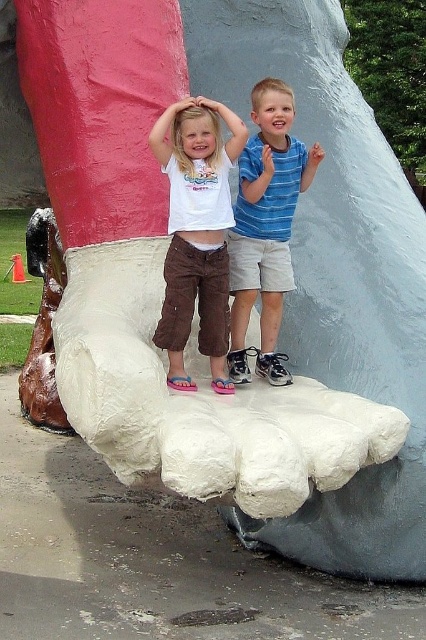
You are a photographer trying to capture both children in a photo. Since you can only focus on one child clearly at a time, which child should you focus on to ensure their face is in focus if you want the matte white shirt at center and the blue striped shirt at center to be in the same photo?

You should focus on the matte white shirt at center because it is closer to the viewer than the blue striped shirt at center, so focusing on it will keep both in focus as the blue striped shirt is behind it.

You are a photographer trying to capture both children in the center of the sculpture. Since the sculpture is uneven, you need to adjust the camera angle so that both the matte white shirt at center and the blue striped shirt at center are fully visible. Which child should you focus on first to ensure their entire shirt is in frame?

The matte white shirt at center has a smaller width than the blue striped shirt at center. Therefore, you should focus on the blue striped shirt at center first to ensure its entire width fits in the frame before adjusting for the smaller matte white shirt at center.

You are taking a photo of the two children standing on the giant foot sculpture. The camera is positioned to capture both children clearly. Which of the two points, point (166, 173) or point (239, 214), is closer to the camera?

Point (166, 173) is closer to the camera than point (239, 214).